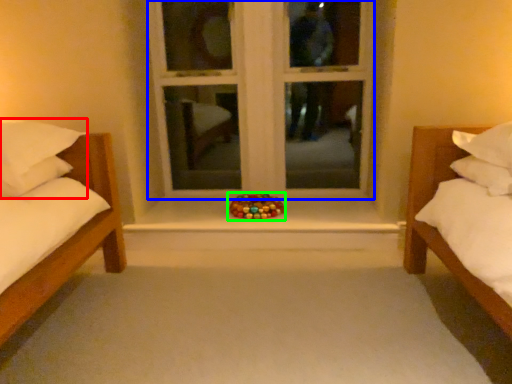
Question: Which object is the closest to the pillow (highlighted by a red box)? Choose among these: window frame (highlighted by a blue box) or toy (highlighted by a green box).

Choices:
 (A) window frame
 (B) toy

Answer: (B)